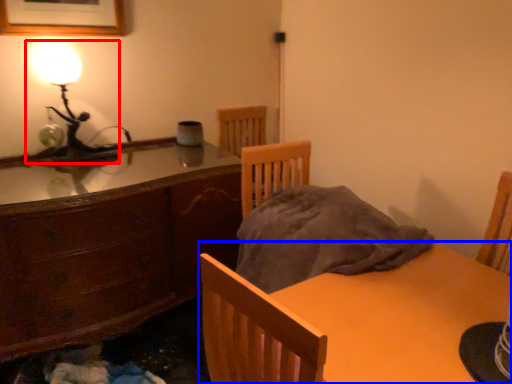
Question: Which object appears closest to the camera in this image, lamp (highlighted by a red box) or table (highlighted by a blue box)?

Choices:
 (A) lamp
 (B) table

Answer: (B)